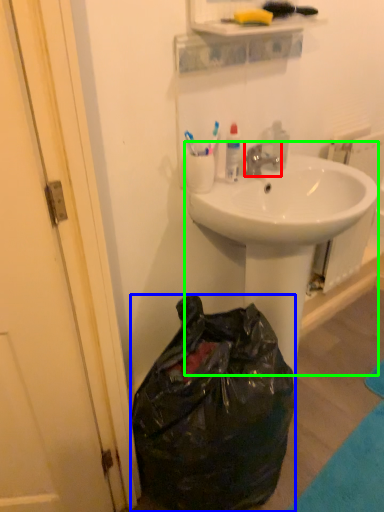
Question: Which object is positioned farthest from faucet (highlighted by a red box)? Select from trash bin/can (highlighted by a blue box) and sink (highlighted by a green box).

Choices:
 (A) trash bin/can
 (B) sink

Answer: (A)